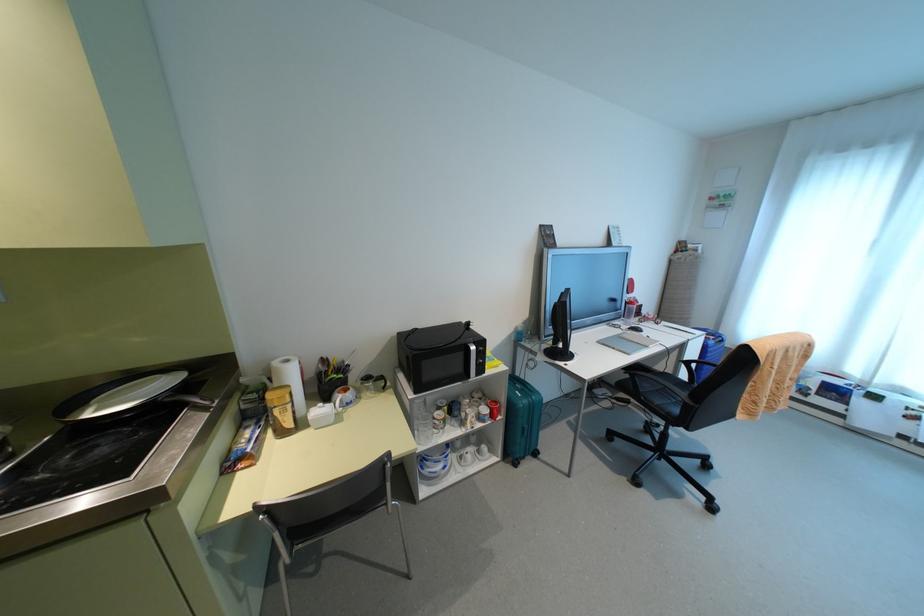
This screenshot has height=616, width=924. Describe the element at coordinates (382, 381) in the screenshot. I see `a glass pitcher handle` at that location.